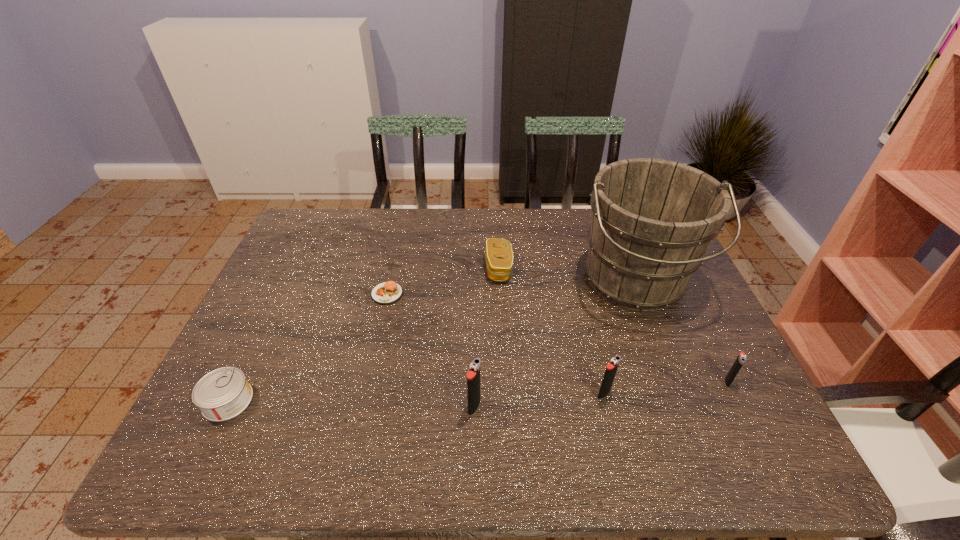
In the current image, all igniters are evenly spaced. To maintain this equal spacing, where should an additional igniter be placed on the left? Please point out a free spot. Please provide its 2D coordinates. Your answer should be formatted as a tuple, i.e. [(x, y)], where the tuple contains the x and y coordinates of a point satisfying the conditions above.

[(338, 420)]